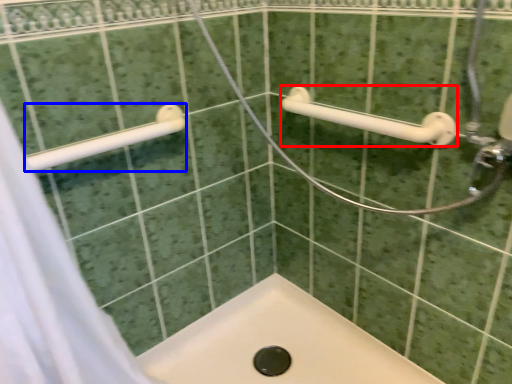
Question: Which of the following is the farthest to the observer, towel rack (highlighted by a red box) or towel rack (highlighted by a blue box)?

Choices:
 (A) towel rack
 (B) towel rack

Answer: (A)